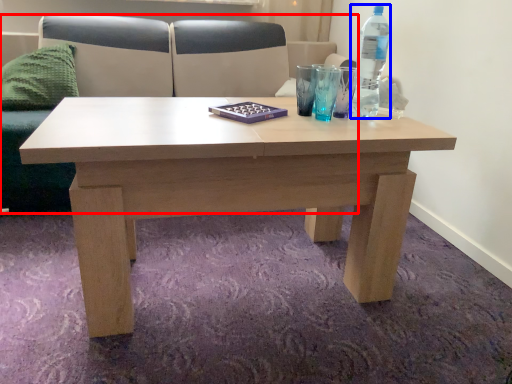
Question: Which object is further to the camera taking this photo, couch (highlighted by a red box) or bottle (highlighted by a blue box)?

Choices:
 (A) couch
 (B) bottle

Answer: (A)